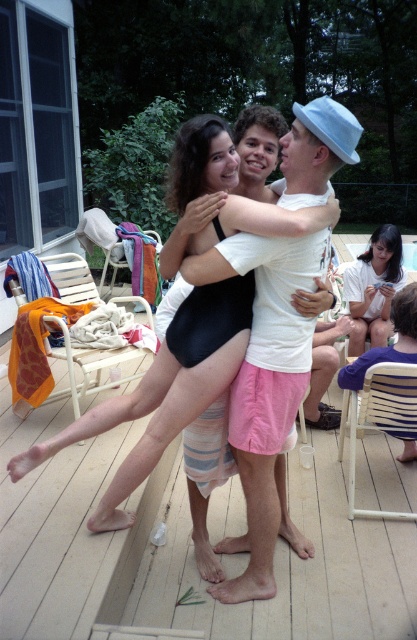
You are at a poolside party and see two people interacting. One is wearing a black matte swimsuit at center and the other has a matte white shirt at upper right. From your vantage point, which person is positioned lower in the scene?

The black matte swimsuit at center is positioned below the matte white shirt at upper right, so the person in the black matte swimsuit at center is lower in the scene.

You are at a poolside party and see two people. One is wearing a black matte swimsuit at center and the other has a matte white shirt at upper right. Which person is standing more to the left side?

The black matte swimsuit at center is more to the left side of the matte white shirt at upper right.

You are a photographer trying to capture a photo of both the black matte swimsuit at center and the matte white shirt at upper right in the same frame. Given that your camera has a minimum focus distance of 5 feet, will you be able to take the photo without moving either object?

The distance between the black matte swimsuit at center and the matte white shirt at upper right is 6.80 feet, which exceeds the camera minimum focus distance of 5 feet. Therefore, you can capture both subjects in the same frame without moving them.